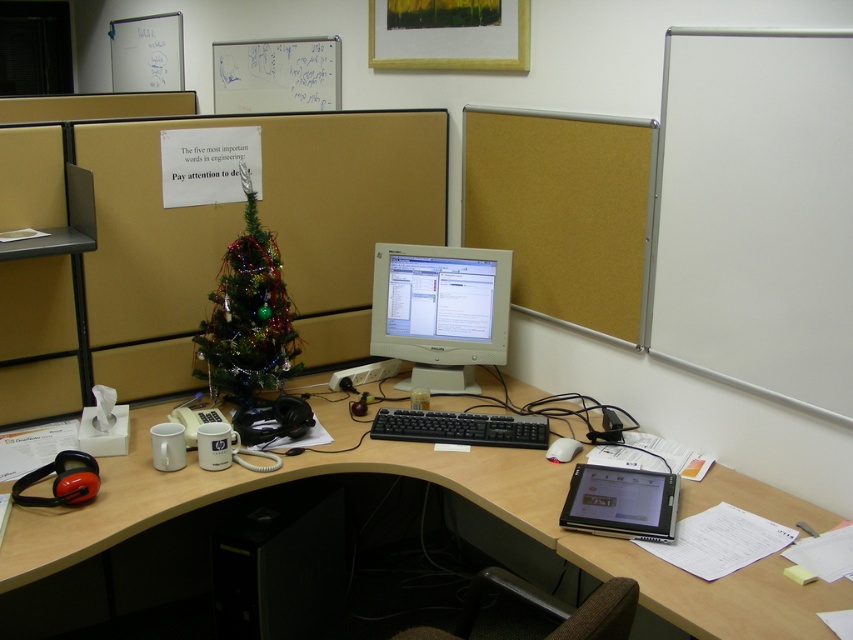
Question: Is matte gray monitor at center positioned in front of white matte mouse at lower right?

Choices:
 (A) yes
 (B) no

Answer: (B)

Question: Which object is closer to the camera taking this photo?

Choices:
 (A) black plastic keyboard at center
 (B) green shiny christmas tree at upper center
 (C) matte gray monitor at center

Answer: (A)

Question: Is green shiny christmas tree at upper center above white matte mouse at lower right?

Choices:
 (A) no
 (B) yes

Answer: (B)

Question: Does corkboard at center appear under silver metallic tablet at lower right?

Choices:
 (A) yes
 (B) no

Answer: (B)

Question: Which of the following is the closest to the observer?

Choices:
 (A) (659, 540)
 (B) (564, 422)
 (C) (438, 419)
 (D) (425, 253)

Answer: (A)

Question: Which point appears farthest from the camera in this image?

Choices:
 (A) (671, 538)
 (B) (376, 433)
 (C) (576, 440)

Answer: (B)